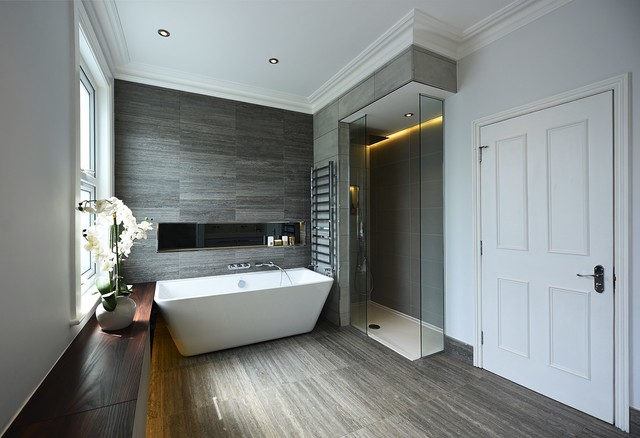
Find the location of a particular element. The width and height of the screenshot is (640, 438). white vase is located at coordinates (120, 315).